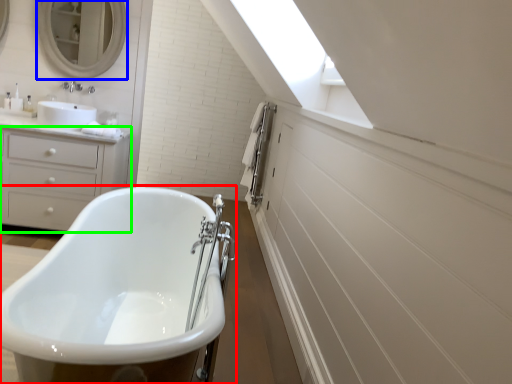
Question: Which is nearer to the bathtub (highlighted by a red box)? mirror (highlighted by a blue box) or chest of drawers (highlighted by a green box).

Choices:
 (A) mirror
 (B) chest of drawers

Answer: (B)